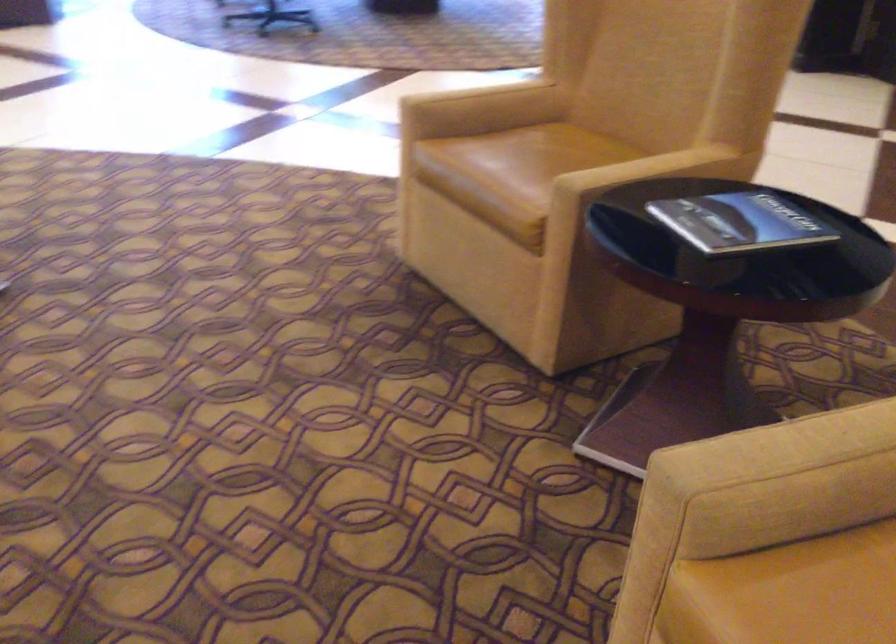
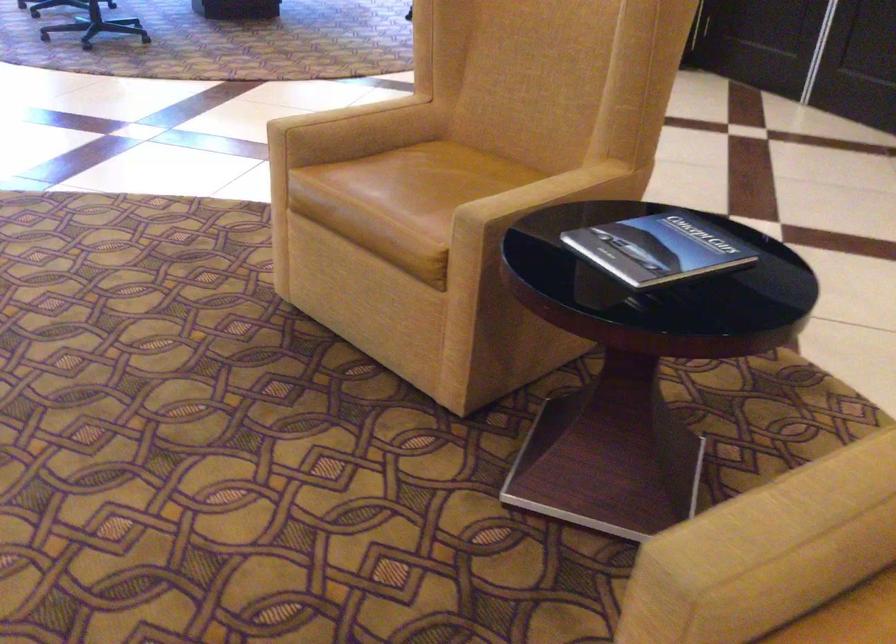
The point at (554, 151) is marked in the first image. Where is the corresponding point in the second image?

(440, 174)